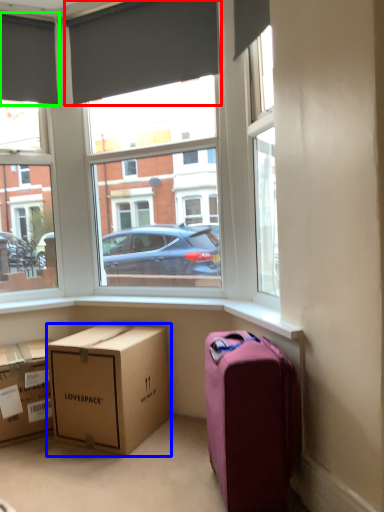
Question: Which object is the closest to the curtain (highlighted by a red box)? Choose among these: box (highlighted by a blue box) or curtain (highlighted by a green box).

Choices:
 (A) box
 (B) curtain

Answer: (B)